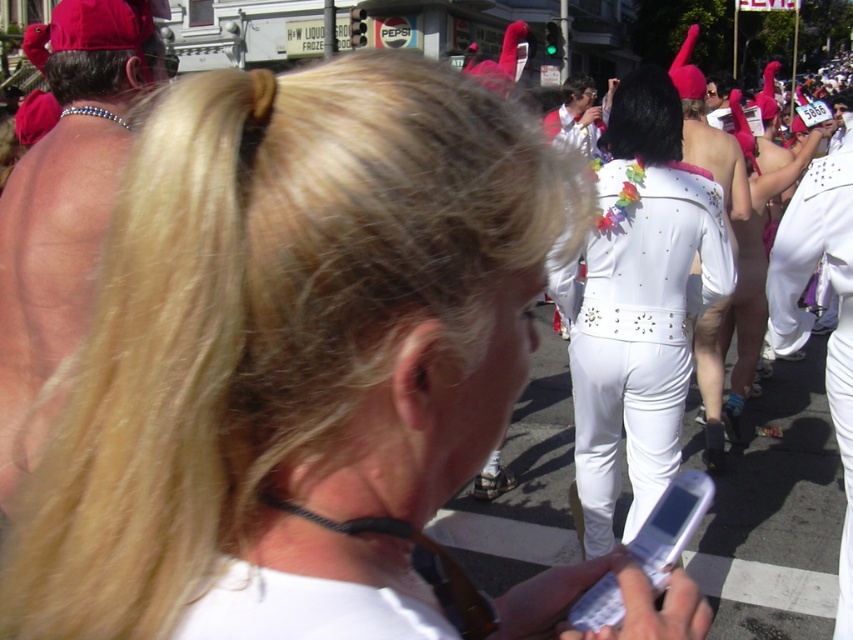
Question: Can you confirm if white shiny jumpsuit at center is bigger than white plastic phone at center?

Choices:
 (A) yes
 (B) no

Answer: (A)

Question: Which of the following is the farthest from the observer?

Choices:
 (A) (616, 252)
 (B) (618, 602)

Answer: (A)

Question: Is the position of white shiny jumpsuit at center less distant than that of white plastic phone at center?

Choices:
 (A) yes
 (B) no

Answer: (B)

Question: Does white shiny jumpsuit at center have a lesser width compared to white plastic phone at center?

Choices:
 (A) no
 (B) yes

Answer: (A)